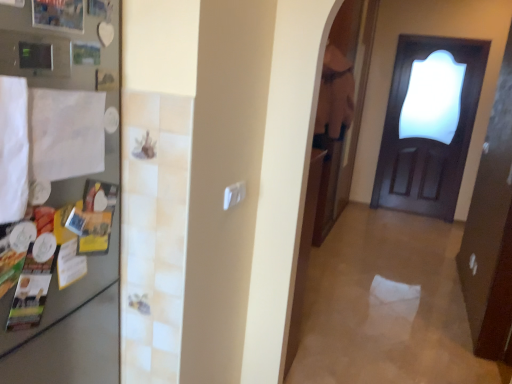
Question: Is satin silver fridge at left situated inside dark wood door at right or outside?

Choices:
 (A) inside
 (B) outside

Answer: (B)

Question: From their relative heights in the image, would you say satin silver fridge at left is taller or shorter than dark wood door at right?

Choices:
 (A) short
 (B) tall

Answer: (A)

Question: From a real-world perspective, is satin silver fridge at left positioned above or below dark wood door at right?

Choices:
 (A) above
 (B) below

Answer: (A)

Question: In the image, is dark wood door at right on the left side or the right side of satin silver fridge at left?

Choices:
 (A) right
 (B) left

Answer: (A)

Question: From the image's perspective, relative to satin silver fridge at left, is dark wood door at right above or below?

Choices:
 (A) below
 (B) above

Answer: (B)

Question: Considering their positions, is dark wood door at right located in front of or behind satin silver fridge at left?

Choices:
 (A) front
 (B) behind

Answer: (B)

Question: Is point click(x=486, y=41) positioned closer to the camera than point click(x=97, y=256)?

Choices:
 (A) closer
 (B) farther

Answer: (B)